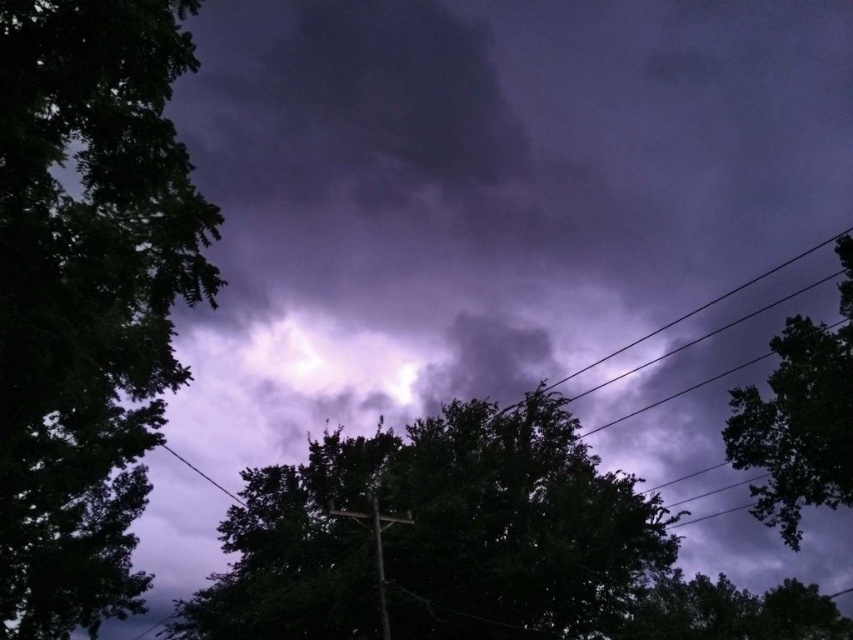
You are an observer standing in front of the two green leafy trees. Which tree is closer to you, the green leafy tree at left or the green leafy tree at right?

The green leafy tree at left is closer to you because it is positioned over the green leafy tree at right, indicating it is in front.

You are a bird flying towards the bright light in the center. Which direction should you go relative to the green leafy tree at left and the green leafy tree at lower right?

The bright light is in the center of the image. Since the green leafy tree at left is to the left of the green leafy tree at lower right, you should fly towards the center between them, moving to the right of the green leafy tree at left and to the left of the green leafy tree at lower right.

You are standing in front of the dramatic sky scene. There are two points marked in the image. The first point is at coordinate point (527, 432) and the second point is at coordinate point (792, 625). Which point is closer to you?

Point (527, 432) is closer to the camera than point (792, 625).